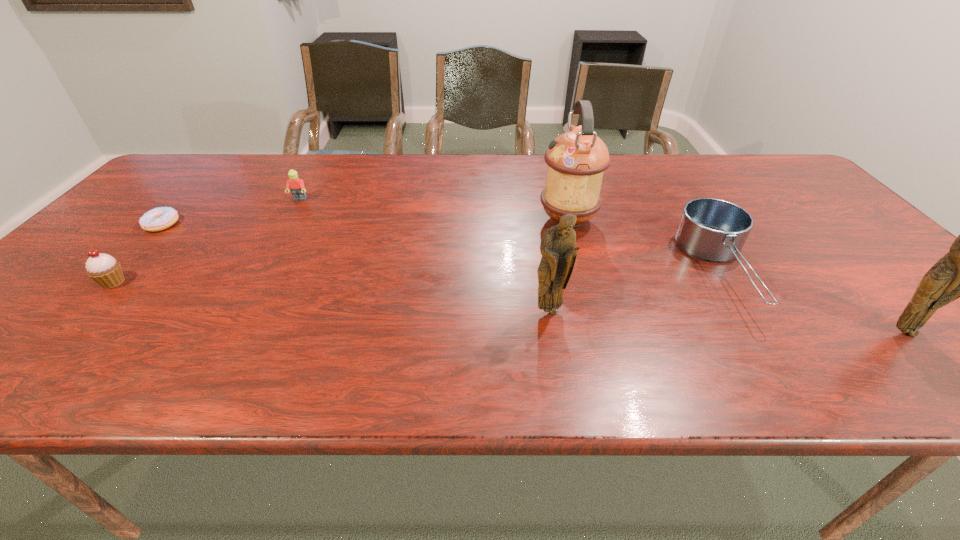
You are a GUI agent. You are given a task and a screenshot of the screen. Output one action in this format:
    pyautogui.click(x=<x>, y=<y>)
    Task: Click on the free space between the Lego and the doughnut
    
    Given the screenshot: What is the action you would take?
    pyautogui.click(x=230, y=212)

Identify the location of empty space between the saucepan and the left figurine. The image size is (960, 540). (636, 291).

Locate an element on the screen. The width and height of the screenshot is (960, 540). empty location between the third object from left to right and the nearer figurine is located at coordinates (602, 265).

Locate an element on the screen. free space between the farther figurine and the saucepan is located at coordinates (636, 291).

Find the location of a particular element. This screenshot has height=540, width=960. the fourth closest object relative to the farther figurine is located at coordinates (296, 184).

Image resolution: width=960 pixels, height=540 pixels. In order to click on the sixth closest object to the cupcake in this screenshot , I will do `click(959, 274)`.

Locate an element on the screen. Image resolution: width=960 pixels, height=540 pixels. free point that satisfies the following two spatial constraints: 1. on the back side of the oil lamp; 2. on the right side of the doughnut is located at coordinates (165, 220).